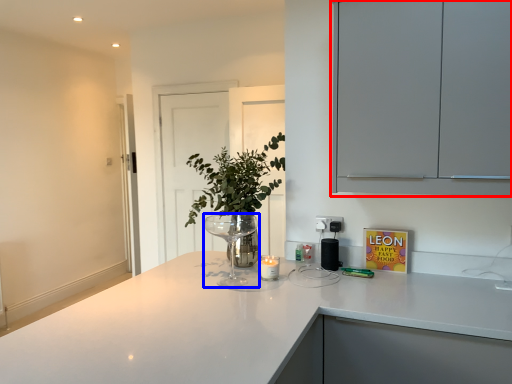
Question: Which point is further to the camera, cabinetry (highlighted by a red box) or wine glass (highlighted by a blue box)?

Choices:
 (A) cabinetry
 (B) wine glass

Answer: (B)